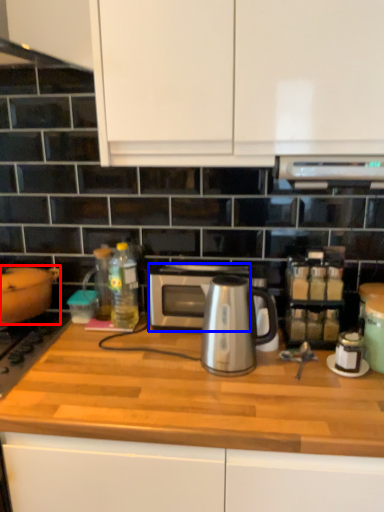
Question: Among these objects, which one is farthest to the camera, kitchen appliance (highlighted by a red box) or microwave oven (highlighted by a blue box)?

Choices:
 (A) kitchen appliance
 (B) microwave oven

Answer: (B)